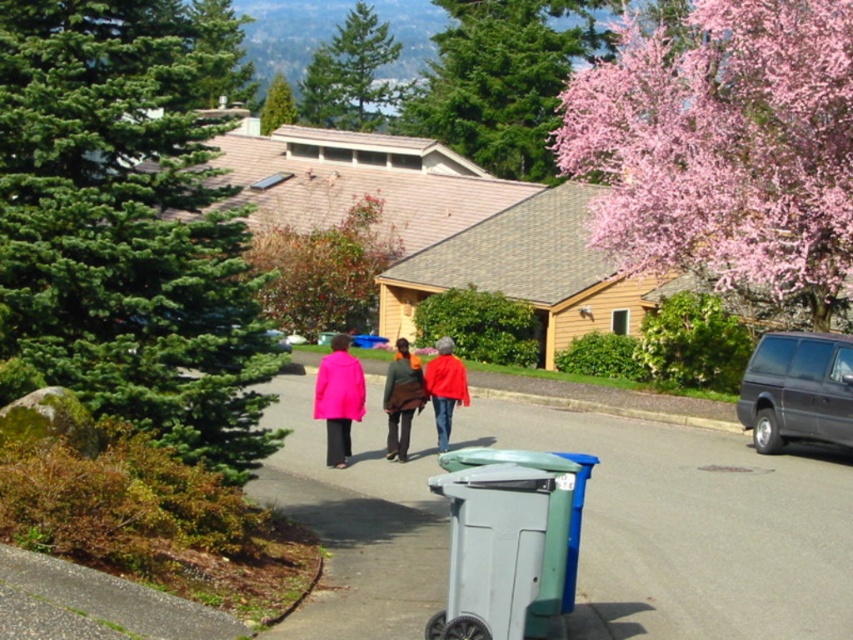
Is green textured pine tree at left further to the viewer compared to green textured evergreen tree at upper center?

No, it is not.

Measure the distance between point (19, 248) and camera.

The distance of point (19, 248) from camera is 11.36 meters.

Image resolution: width=853 pixels, height=640 pixels. Identify the location of green textured pine tree at left. (126, 228).

Is dark gray metallic van at right positioned in front of pink matte coat at center?

No, dark gray metallic van at right is further to the viewer.

Which of these two, dark gray metallic van at right or pink matte coat at center, stands shorter?

Standing shorter between the two is pink matte coat at center.

The width and height of the screenshot is (853, 640). I want to click on dark gray metallic van at right, so click(x=798, y=388).

Who is higher up, green textured pine tree at upper center or matte red jacket at center?

Positioned higher is green textured pine tree at upper center.

Is point (339, 100) positioned in front of point (434, 385)?

No, (339, 100) is behind (434, 385).

Locate an element on the screen. This screenshot has width=853, height=640. green textured pine tree at upper center is located at coordinates (350, 74).